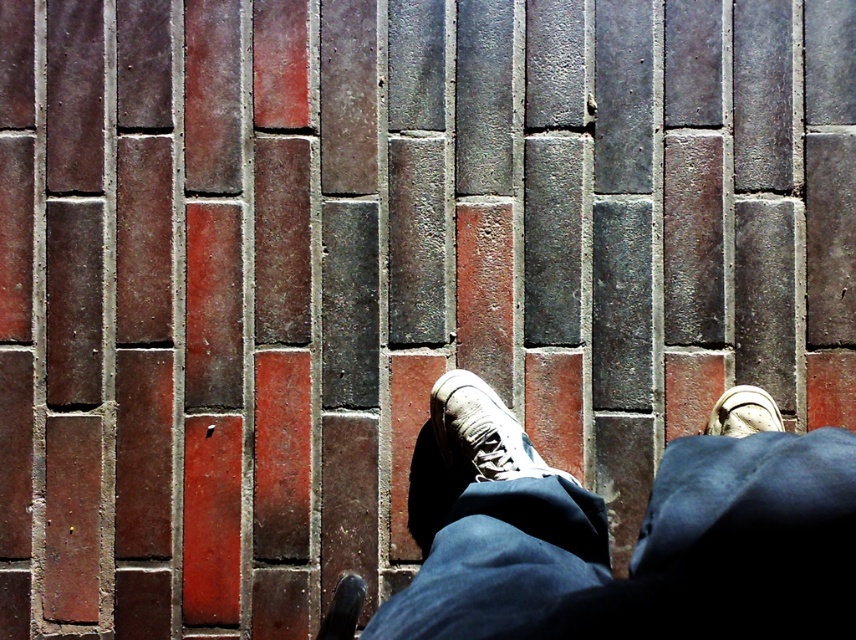
Does dark blue denim jeans at center appear on the left side of white canvas shoe at center?

In fact, dark blue denim jeans at center is to the right of white canvas shoe at center.

Which is in front, point (633, 630) or point (468, 412)?

Point (633, 630) is more forward.

This screenshot has height=640, width=856. Identify the location of dark blue denim jeans at center. (639, 548).

Which is in front, point (669, 545) or point (354, 618)?

Point (669, 545) is in front.

Is dark blue denim jeans at center positioned before shiny black shoe at lower center?

Yes, it is.

Who is more distant from viewer, (506, 490) or (330, 628)?

The point (330, 628) is more distant.

Where is `dark blue denim jeans at center`? This screenshot has height=640, width=856. dark blue denim jeans at center is located at coordinates (639, 548).

Is the position of white canvas shoe at center more distant than that of white suede shoe at lower right?

No, it is in front of white suede shoe at lower right.

Is white canvas shoe at center to the right of white suede shoe at lower right from the viewer's perspective?

No, white canvas shoe at center is not to the right of white suede shoe at lower right.

You are a GUI agent. You are given a task and a screenshot of the screen. Output one action in this format:
    pyautogui.click(x=<x>, y=<y>)
    Task: Click on the white canvas shoe at center
    This screenshot has height=640, width=856.
    Given the screenshot: What is the action you would take?
    pyautogui.click(x=480, y=433)

Where is `white canvas shoe at center`? white canvas shoe at center is located at coordinates (480, 433).